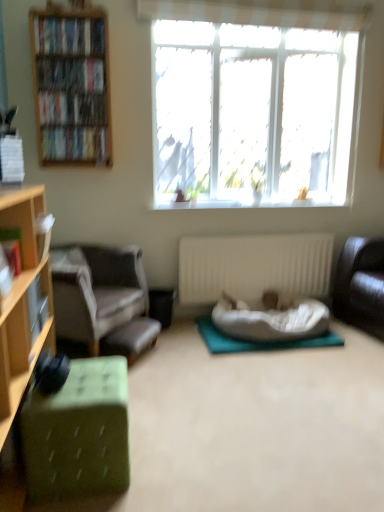
I want to click on free space in front of green fabric footrest at lower left, so click(x=152, y=374).